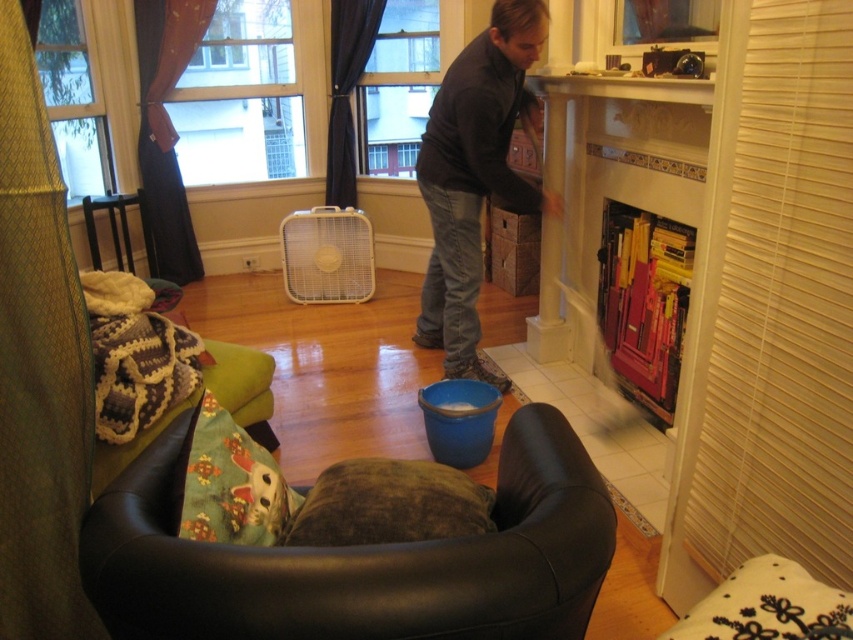
From the picture: Between brown suede bean bag at lower center and dark gray sweater at center, which one appears on the left side from the viewer's perspective?

From the viewer's perspective, brown suede bean bag at lower center appears more on the left side.

Does brown suede bean bag at lower center have a lesser height compared to dark gray sweater at center?

Indeed, brown suede bean bag at lower center has a lesser height compared to dark gray sweater at center.

Measure the distance between brown suede bean bag at lower center and camera.

A distance of 34.39 inches exists between brown suede bean bag at lower center and camera.

You are a GUI agent. You are given a task and a screenshot of the screen. Output one action in this format:
    pyautogui.click(x=<x>, y=<y>)
    Task: Click on the brown suede bean bag at lower center
    
    Given the screenshot: What is the action you would take?
    pyautogui.click(x=363, y=560)